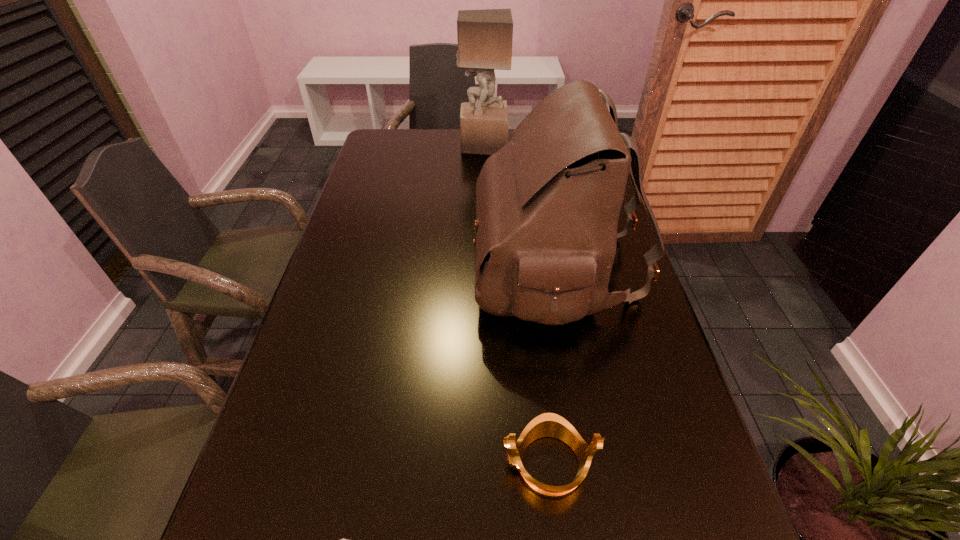
I want to click on vacant area located on the front flap of the third farthest object, so click(x=332, y=267).

This screenshot has height=540, width=960. Find the location of `free space located 0.080m on the front of the third tallest object`. free space located 0.080m on the front of the third tallest object is located at coordinates (588, 195).

The height and width of the screenshot is (540, 960). I want to click on vacant space located 0.080m at the front emblem of the tiara, so click(455, 463).

Find the location of a particular element. The width and height of the screenshot is (960, 540). vacant space located at the front emblem of the tiara is located at coordinates click(x=380, y=463).

The image size is (960, 540). In order to click on free space located 0.070m at the front emblem of the tiara in this screenshot , I will do `click(461, 463)`.

Where is `sculpture that is at the far edge`? The image size is (960, 540). sculpture that is at the far edge is located at coordinates (485, 36).

Locate an element on the screen. detergent that is at the far edge is located at coordinates (599, 90).

Where is `satchel present at the right edge`? satchel present at the right edge is located at coordinates pos(547,203).

Where is `detergent that is at the right edge`? detergent that is at the right edge is located at coordinates (599, 90).

In order to click on object that is at the far right corner in this screenshot , I will do `click(599, 90)`.